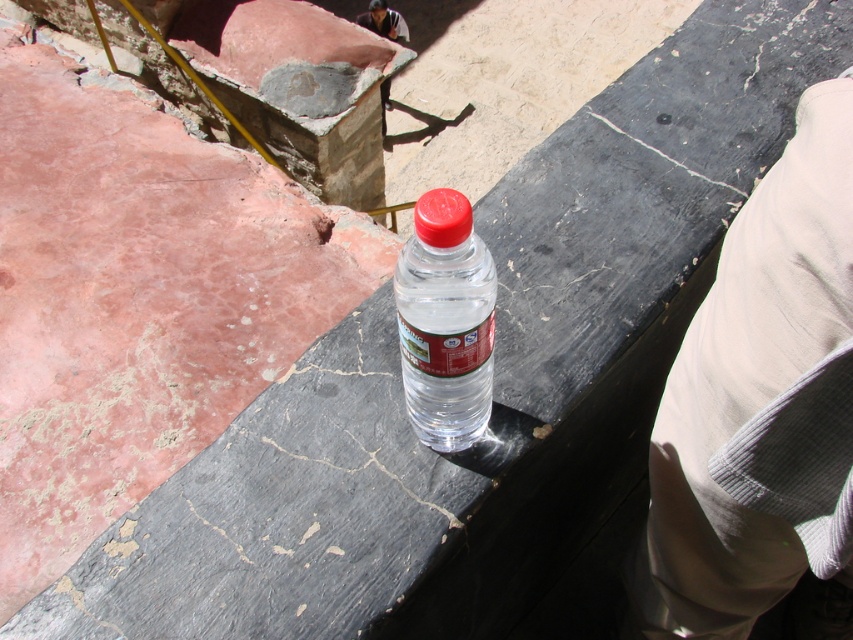
Question: Among these points, which one is nearest to the camera?

Choices:
 (A) (815, 384)
 (B) (482, 296)

Answer: (A)

Question: Is beige corduroy pants at lower right below transparent plastic bottle at center?

Choices:
 (A) yes
 (B) no

Answer: (A)

Question: Is beige corduroy pants at lower right closer to the viewer compared to transparent plastic bottle at center?

Choices:
 (A) yes
 (B) no

Answer: (A)

Question: Which object is farther from the camera taking this photo?

Choices:
 (A) beige corduroy pants at lower right
 (B) transparent plastic bottle at center

Answer: (B)

Question: Is beige corduroy pants at lower right further to the viewer compared to transparent plastic bottle at center?

Choices:
 (A) yes
 (B) no

Answer: (B)